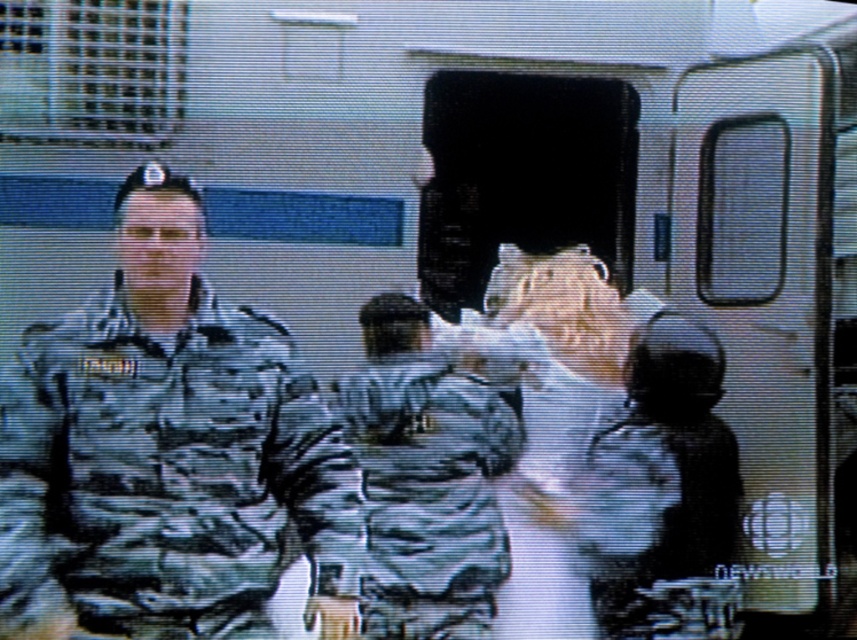
Question: Among these objects, which one is farthest from the camera?

Choices:
 (A) camouflage fabric uniform at lower right
 (B) camouflage fabric uniform at center
 (C) camo uniform at center

Answer: (A)

Question: Which point is closer to the camera taking this photo?

Choices:
 (A) (688, 461)
 (B) (96, 499)
 (C) (490, 621)

Answer: (B)

Question: From the image, what is the correct spatial relationship of camouflage fabric uniform at center in relation to camouflage fabric uniform at lower right?

Choices:
 (A) left
 (B) right

Answer: (A)

Question: In this image, where is camouflage fabric uniform at center located relative to camouflage fabric uniform at lower right?

Choices:
 (A) above
 (B) below

Answer: (A)

Question: Among these objects, which one is farthest from the camera?

Choices:
 (A) camouflage fabric uniform at center
 (B) camo uniform at center
 (C) camouflage fabric uniform at lower right

Answer: (C)

Question: Is camouflage fabric uniform at center smaller than camouflage fabric uniform at lower right?

Choices:
 (A) yes
 (B) no

Answer: (B)